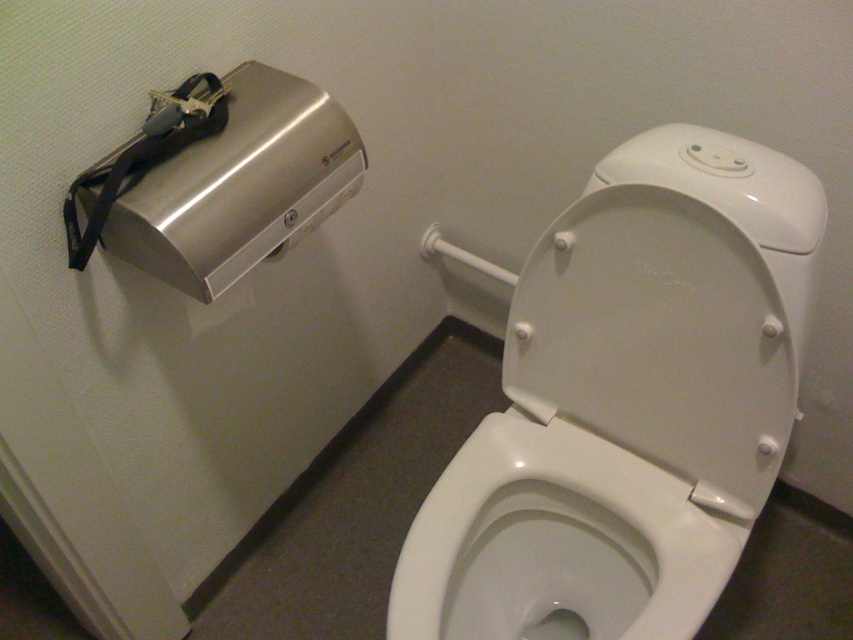
You are standing in the restroom and see the point marked at coordinates (x=556, y=544). Based on the scene description, can you identify what object this point is located on?

The point is located on the white glossy toilet bowl at center.

You are a maintenance worker needing to replace a part on the satin silver hand dryer at upper left. You have a tool that is 20 inches long. If you stand next to the white glossy toilet bowl at center, will your tool reach the hand dryer?

The distance between the white glossy toilet bowl at center and the satin silver hand dryer at upper left is 20.66 inches. Since your tool is 20 inches long, it is slightly shorter than the required distance. Therefore, the tool will not reach the hand dryer.

Consider the image. You are standing in the restroom and need to reach the white glossy toilet bowl at center. What are the coordinates of the toilet bowl?

The white glossy toilet bowl at center is located at coordinates point (556, 544).